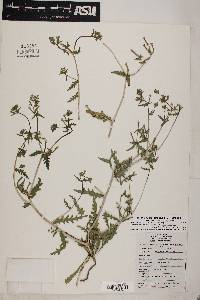
Locate an element on the screen. blank space on right of plant is located at coordinates (170, 74).